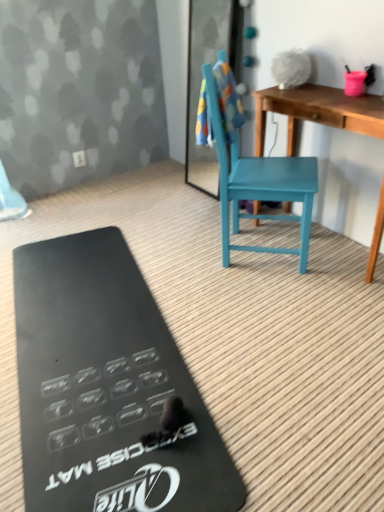
Question: Should I look upward or downward to see multicolored fabric towel at upper center?

Choices:
 (A) up
 (B) down

Answer: (A)

Question: Does teal wood chair at center have a larger size compared to black rubber exercise mat at lower left?

Choices:
 (A) no
 (B) yes

Answer: (B)

Question: Is teal wood chair at center shorter than black rubber exercise mat at lower left?

Choices:
 (A) yes
 (B) no

Answer: (B)

Question: Is teal wood chair at center next to black rubber exercise mat at lower left and touching it?

Choices:
 (A) yes
 (B) no

Answer: (B)

Question: Is teal wood chair at center positioned before black rubber exercise mat at lower left?

Choices:
 (A) yes
 (B) no

Answer: (B)

Question: Can you confirm if teal wood chair at center is positioned to the left of black rubber exercise mat at lower left?

Choices:
 (A) no
 (B) yes

Answer: (A)

Question: Is teal wood chair at center smaller than black rubber exercise mat at lower left?

Choices:
 (A) yes
 (B) no

Answer: (B)

Question: Considering the relative sizes of multicolored fabric towel at upper center and teal wood chair at center in the image provided, is multicolored fabric towel at upper center bigger than teal wood chair at center?

Choices:
 (A) yes
 (B) no

Answer: (B)

Question: From the image's perspective, is multicolored fabric towel at upper center on teal wood chair at center?

Choices:
 (A) no
 (B) yes

Answer: (B)

Question: Is multicolored fabric towel at upper center wider than teal wood chair at center?

Choices:
 (A) yes
 (B) no

Answer: (B)

Question: Considering the relative sizes of multicolored fabric towel at upper center and teal wood chair at center in the image provided, is multicolored fabric towel at upper center smaller than teal wood chair at center?

Choices:
 (A) no
 (B) yes

Answer: (B)

Question: Could you tell me if multicolored fabric towel at upper center is facing teal wood chair at center?

Choices:
 (A) yes
 (B) no

Answer: (A)

Question: Does multicolored fabric towel at upper center have a lesser width compared to teal wood chair at center?

Choices:
 (A) no
 (B) yes

Answer: (B)

Question: Can we say teal wood chair at center lies outside multicolored fabric towel at upper center?

Choices:
 (A) no
 (B) yes

Answer: (B)